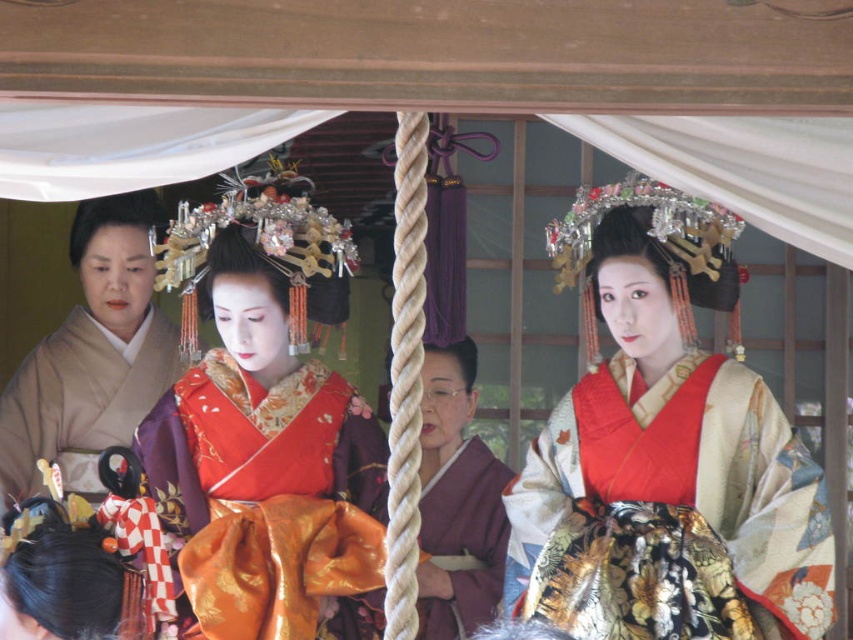
Question: Which is farther from the silky orange kimono at center?

Choices:
 (A) matte purple kimono at center
 (B) silky silk kimono at center
 (C) silky purple kimono at left

Answer: (C)

Question: In this image, where is silky silk kimono at center located relative to silky purple kimono at left?

Choices:
 (A) right
 (B) left

Answer: (A)

Question: Is silky silk kimono at center positioned behind matte purple kimono at center?

Choices:
 (A) no
 (B) yes

Answer: (A)

Question: Which of the following is the closest to the observer?

Choices:
 (A) (646, 337)
 (B) (352, 532)

Answer: (B)

Question: Which of the following is the closest to the observer?

Choices:
 (A) silky silk kimono at center
 (B) matte purple kimono at center

Answer: (A)

Question: Is silky silk kimono at center to the right of silky orange kimono at center from the viewer's perspective?

Choices:
 (A) no
 (B) yes

Answer: (B)